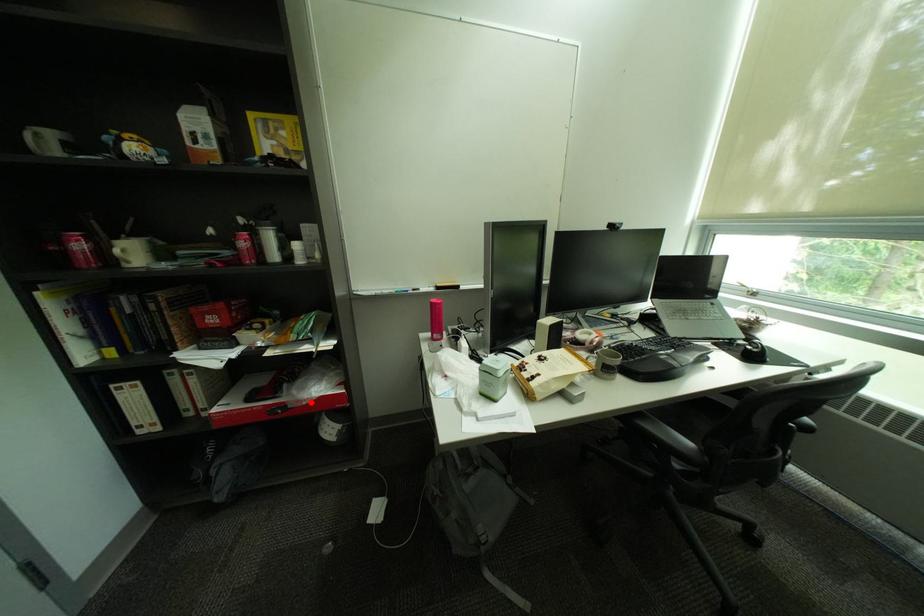
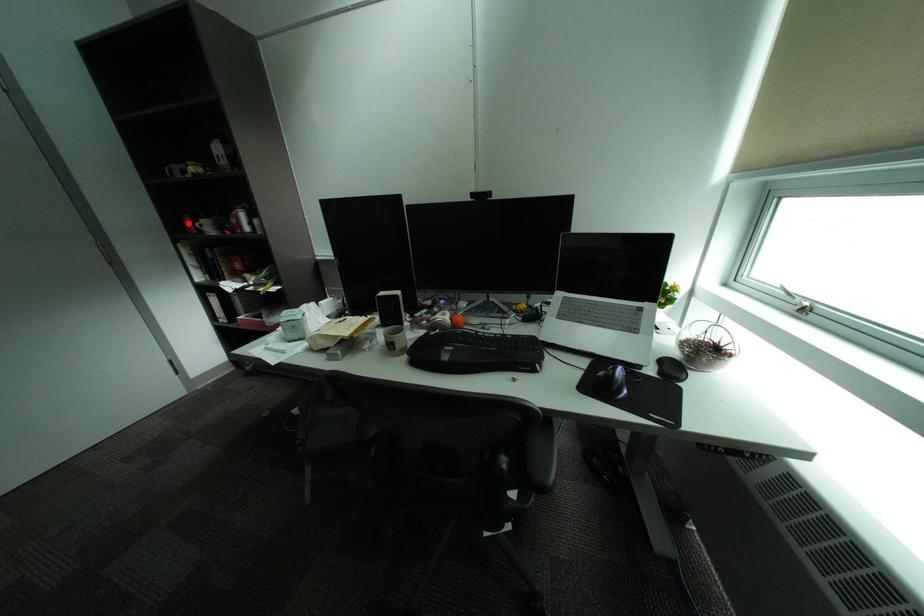
I am providing you with two images of the same scene from different viewpoints. A red point is marked on the first image and another point is marked on the second image. Are the points marked in image1 and image2 representing the same 3D position?

No